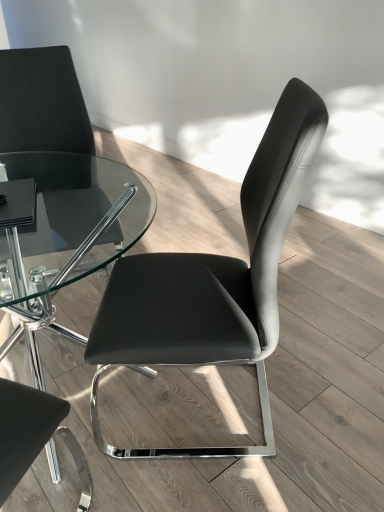
The width and height of the screenshot is (384, 512). I want to click on vacant space to the right of black leather chair at center, the first chair viewed from the right, so click(x=322, y=391).